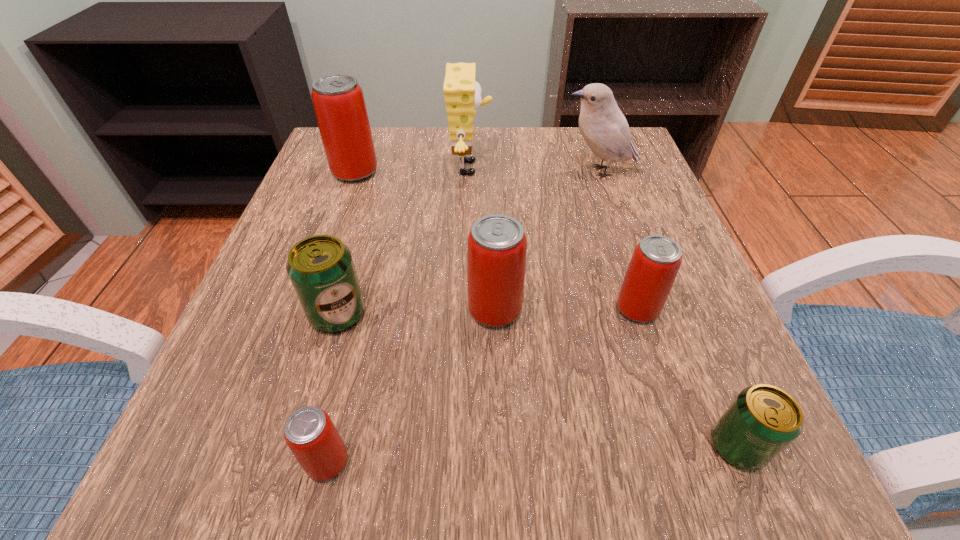
Locate an element on the screen. This screenshot has height=540, width=960. the third pink beer can from right to left is located at coordinates pyautogui.click(x=310, y=434).

This screenshot has height=540, width=960. Identify the location of the nearest pink beer can. (310, 434).

At what (x,y) coordinates should I click in order to perform the action: click on the smaller green beer can. Please return your answer as a coordinate pair (x, y). Looking at the image, I should click on (763, 420).

Identify the location of the rightmost beer can. Image resolution: width=960 pixels, height=540 pixels. (763, 420).

The image size is (960, 540). Find the location of `vacant space located on the front-facing side of the yellow sponge`. vacant space located on the front-facing side of the yellow sponge is located at coordinates (608, 168).

The height and width of the screenshot is (540, 960). In order to click on free spot located 0.080m on the back of the tallest beer can in this screenshot , I will do `click(366, 143)`.

The height and width of the screenshot is (540, 960). I want to click on vacant area situated at the beak of the bird, so click(x=379, y=172).

Where is `vacant space located at the beak of the bird`? vacant space located at the beak of the bird is located at coordinates (406, 172).

Where is `vacant position located 0.180m at the beak of the bird`? The width and height of the screenshot is (960, 540). vacant position located 0.180m at the beak of the bird is located at coordinates (478, 172).

Image resolution: width=960 pixels, height=540 pixels. Identify the location of vacant space situated 0.220m on the back of the fifth shortest object. (492, 209).